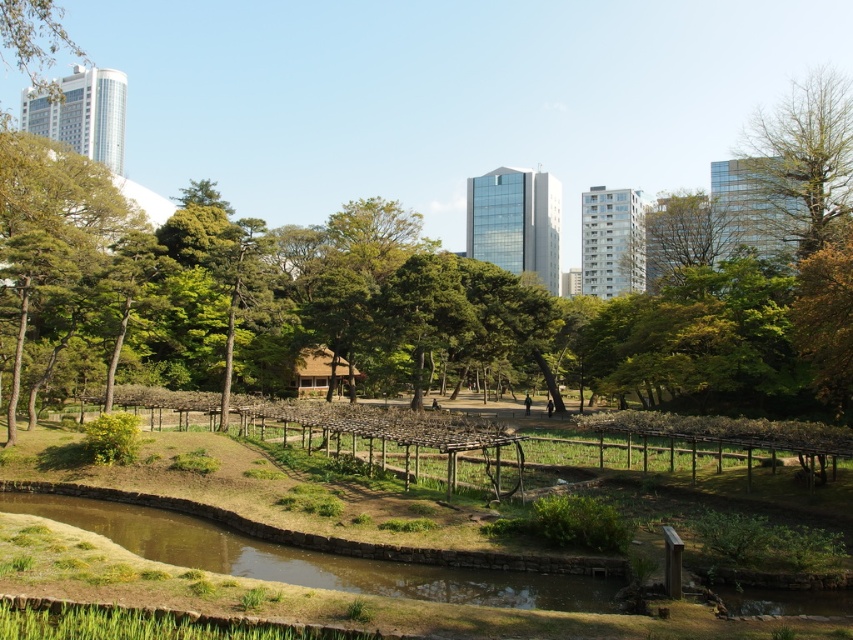
Is green wooden trellis at center smaller than bare wood tree at upper right?

Indeed, green wooden trellis at center has a smaller size compared to bare wood tree at upper right.

Does green wooden trellis at center appear over bare wood tree at upper right?

Actually, green wooden trellis at center is below bare wood tree at upper right.

Who is more distant from viewer, (519, 612) or (817, 112)?

The point (817, 112) is behind.

This screenshot has width=853, height=640. Find the location of `green wooden trellis at center`. green wooden trellis at center is located at coordinates (556, 621).

Between point (544, 620) and point (228, 566), which one is positioned in front?

Point (544, 620)

At what (x,y) coordinates should I click in order to perform the action: click on green wooden trellis at center. Please return your answer as a coordinate pair (x, y). Looking at the image, I should click on (556, 621).

Can you confirm if green grassy river at center is shorter than bare wood tree at upper right?

Yes.

Is point (96, 516) in front of point (793, 148)?

Yes, point (96, 516) is in front of point (793, 148).

This screenshot has height=640, width=853. Describe the element at coordinates (312, 560) in the screenshot. I see `green grassy river at center` at that location.

In order to click on green grassy river at center in this screenshot , I will do `click(312, 560)`.